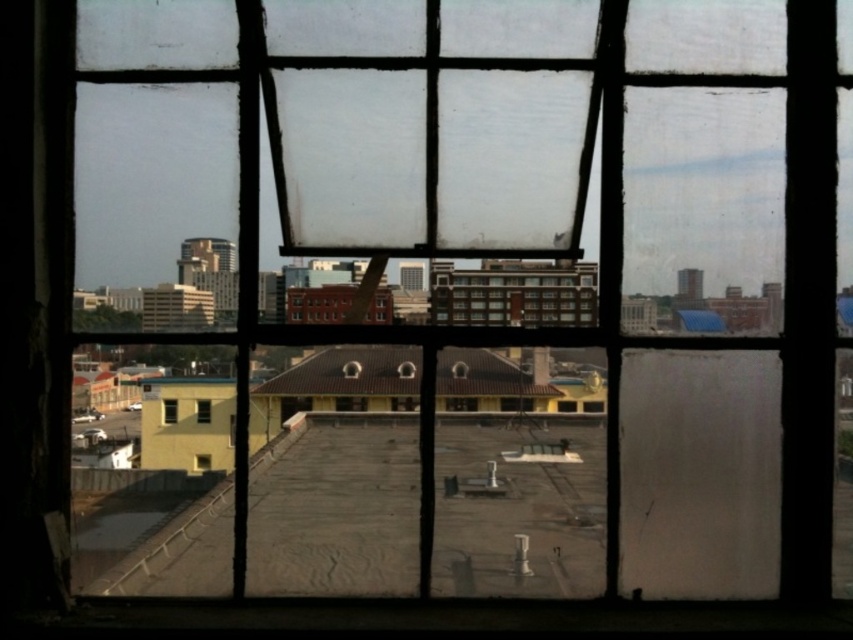
You are an interior designer assessing the lighting in a room. You notice two windows, the transparent glass window at center and the clear glass window at center. Which window allows more natural light into the room?

The transparent glass window at center is located above the clear glass window at center, but since both are types of glass, their transparency likely allows similar light passage. However, the positioning might affect how much light enters depending on the sun angle, but the description doesn not specify light transmission differences.

You are standing in a room and want to look outside through the clear glass window at center. According to the coordinates given, where exactly should you look to see the clearest view?

The clear glass window at center is located at coordinates point (169, 410), so you should look there to see the clearest view.

You are standing in a room with a window that has a grid structure. You see two points marked on the window at coordinates point (167, 397) and point (202, 470). From your perspective inside the room, which point is closer to you?

Point (167, 397) is in front of point (202, 470), so it is closer to you.